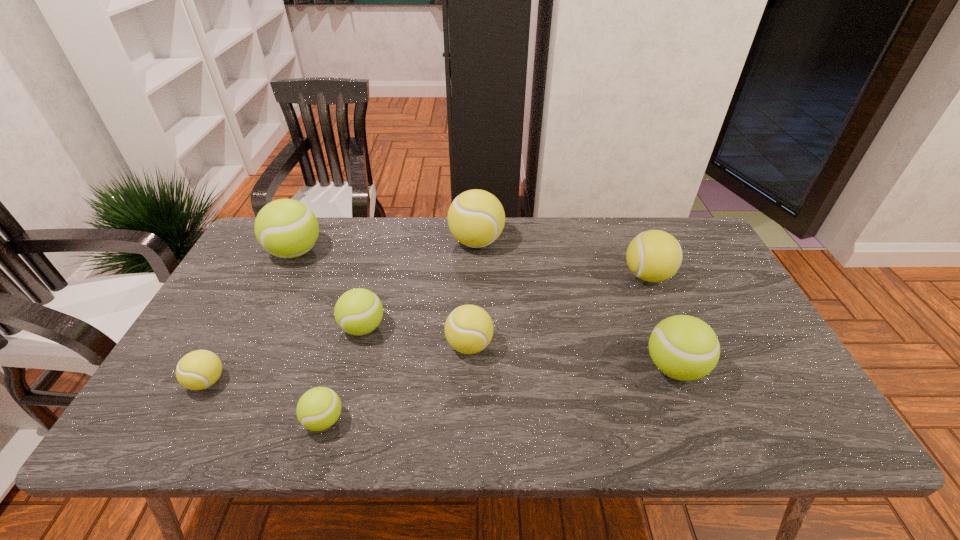
The width and height of the screenshot is (960, 540). What are the coordinates of `the nearest green tennis ball` in the screenshot? It's located at (319, 408).

Find the location of a particular element. the smallest green tennis ball is located at coordinates (319, 408).

Find the location of a particular element. Image resolution: width=960 pixels, height=540 pixels. free region located 0.150m on the left of the farthest yellow tennis ball is located at coordinates (402, 241).

Locate an element on the screen. blank space located 0.380m on the front of the biggest green tennis ball is located at coordinates (234, 376).

Locate an element on the screen. This screenshot has height=540, width=960. vacant area located 0.050m on the right of the rightmost yellow tennis ball is located at coordinates (689, 276).

This screenshot has width=960, height=540. I want to click on free point located 0.390m on the back of the third smallest green tennis ball, so click(627, 248).

Identify the location of vacant space located 0.390m on the right of the second smallest yellow tennis ball. (648, 345).

At what (x,y) coordinates should I click in order to perform the action: click on vacant space located 0.370m on the right of the second smallest green tennis ball. Please return your answer as a coordinate pair (x, y). The image size is (960, 540). Looking at the image, I should click on (527, 328).

Image resolution: width=960 pixels, height=540 pixels. Identify the location of blank space located 0.170m on the back of the smallest yellow tennis ball. (244, 314).

Where is `free space located on the back of the smallest green tennis ball`? free space located on the back of the smallest green tennis ball is located at coordinates (353, 317).